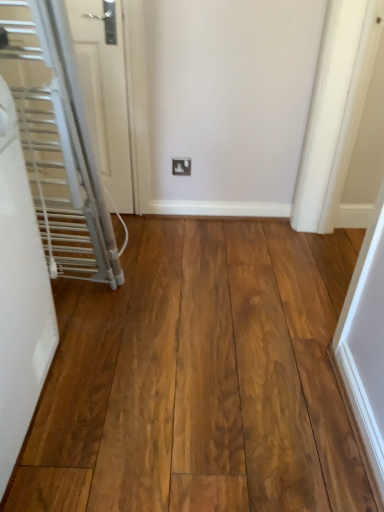
Question: Considering the relative sizes of natural wood flooring at center and white glossy door at left, arranged as the second door when viewed from the front, in the image provided, is natural wood flooring at center thinner than white glossy door at left, arranged as the second door when viewed from the front,?

Choices:
 (A) no
 (B) yes

Answer: (A)

Question: From a real-world perspective, is natural wood flooring at center on top of white glossy door at left, arranged as the second door when viewed from the front?

Choices:
 (A) yes
 (B) no

Answer: (B)

Question: Is natural wood flooring at center not near white glossy door at left, placed as the 1th door when sorted from back to front?

Choices:
 (A) yes
 (B) no

Answer: (B)

Question: Could white glossy door at left, placed as the 1th door when sorted from back to front, be considered to be inside natural wood flooring at center?

Choices:
 (A) no
 (B) yes

Answer: (A)

Question: Is the depth of natural wood flooring at center greater than that of white glossy door at left, arranged as the second door when viewed from the front?

Choices:
 (A) yes
 (B) no

Answer: (B)

Question: From a real-world perspective, is natural wood flooring at center physically below white glossy door at left, arranged as the second door when viewed from the front?

Choices:
 (A) yes
 (B) no

Answer: (A)

Question: Is white plastic outlet at center to the left of white glossy door at left, arranged as the second door when viewed from the front, from the viewer's perspective?

Choices:
 (A) no
 (B) yes

Answer: (A)

Question: Considering the relative sizes of white plastic outlet at center and white glossy door at left, placed as the 1th door when sorted from back to front, in the image provided, is white plastic outlet at center thinner than white glossy door at left, placed as the 1th door when sorted from back to front,?

Choices:
 (A) yes
 (B) no

Answer: (A)

Question: From the image's perspective, is white plastic outlet at center above white glossy door at left, placed as the 1th door when sorted from back to front?

Choices:
 (A) yes
 (B) no

Answer: (B)

Question: Is white plastic outlet at center surrounding white glossy door at left, arranged as the second door when viewed from the front?

Choices:
 (A) yes
 (B) no

Answer: (B)

Question: Can you confirm if white plastic outlet at center is wider than white glossy door at left, arranged as the second door when viewed from the front?

Choices:
 (A) yes
 (B) no

Answer: (B)

Question: From the image's perspective, is white plastic outlet at center below white glossy door at left, arranged as the second door when viewed from the front?

Choices:
 (A) yes
 (B) no

Answer: (A)

Question: Is white matte radiator at left, which appears as the 1th door when viewed from the front, smaller than white plastic outlet at center?

Choices:
 (A) yes
 (B) no

Answer: (B)